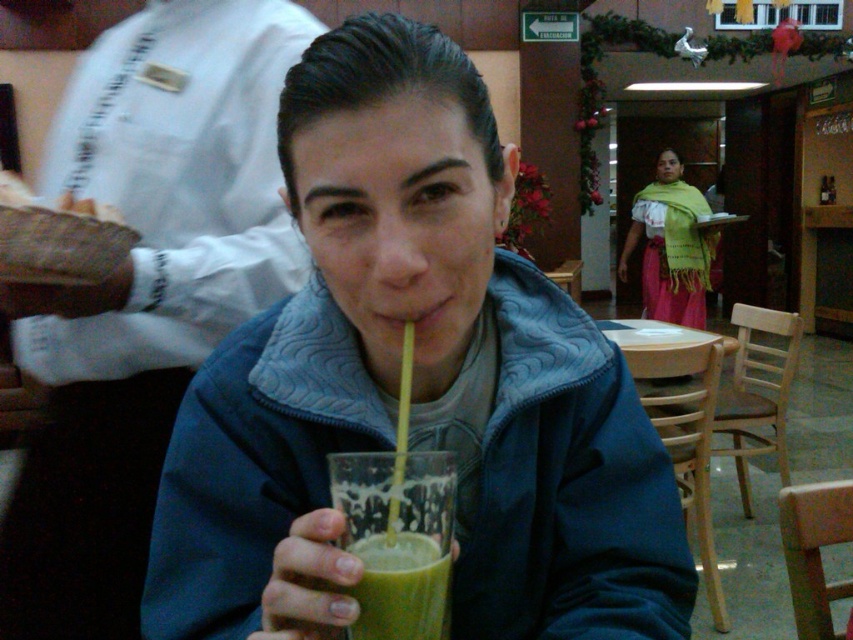
Question: Among these points, which one is farthest from the camera?

Choices:
 (A) (189, 509)
 (B) (451, 524)
 (C) (669, 296)
 (D) (434, 624)

Answer: (C)

Question: Which point appears closest to the camera in this image?

Choices:
 (A) (364, 291)
 (B) (705, 268)
 (C) (370, 524)
 (D) (363, 540)

Answer: (D)

Question: Can you confirm if green woven scarf at center is thinner than green smoothie at center?

Choices:
 (A) yes
 (B) no

Answer: (B)

Question: Can you confirm if matte glass cup at center is positioned to the left of green smoothie at center?

Choices:
 (A) yes
 (B) no

Answer: (A)

Question: Where is matte glass cup at center located in relation to green smoothie at center in the image?

Choices:
 (A) right
 (B) left

Answer: (B)

Question: Which point is closer to the camera taking this photo?

Choices:
 (A) (480, 355)
 (B) (378, 476)

Answer: (B)